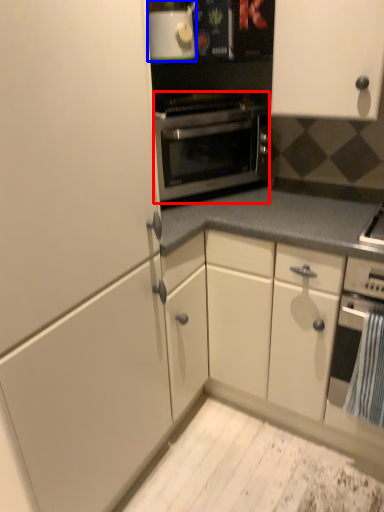
Question: Which of the following is the closest to the observer, oven (highlighted by a red box) or appliance (highlighted by a blue box)?

Choices:
 (A) oven
 (B) appliance

Answer: (B)